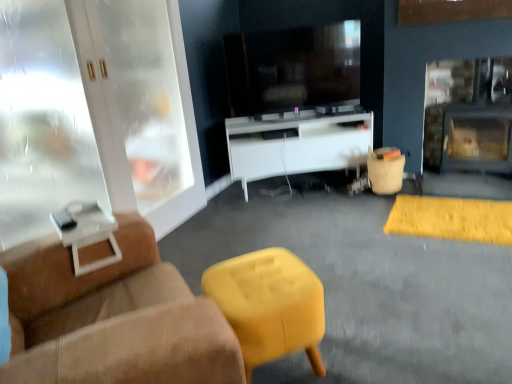
Question: Could you tell me if matte black fireplace at right is turned towards white glossy cabinet at left?

Choices:
 (A) no
 (B) yes

Answer: (A)

Question: From a real-world perspective, is matte black fireplace at right under white glossy cabinet at left?

Choices:
 (A) no
 (B) yes

Answer: (B)

Question: Is matte black fireplace at right at the right side of white glossy cabinet at left?

Choices:
 (A) no
 (B) yes

Answer: (B)

Question: Is matte black fireplace at right positioned before white glossy cabinet at left?

Choices:
 (A) yes
 (B) no

Answer: (B)

Question: Is matte black fireplace at right thinner than white glossy cabinet at left?

Choices:
 (A) no
 (B) yes

Answer: (A)

Question: Is matte black fireplace at right located outside white glossy cabinet at left?

Choices:
 (A) no
 (B) yes

Answer: (B)

Question: From a real-world perspective, is bamboo basket at right, the 1th bar stool positioned from the top, positioned over matte yellow stool at center, the second bar stool viewed from the top, based on gravity?

Choices:
 (A) yes
 (B) no

Answer: (A)

Question: Is bamboo basket at right, marked as the 2th bar stool in a left-to-right arrangement, completely or partially outside of matte yellow stool at center, placed as the 1th bar stool when sorted from front to back?

Choices:
 (A) no
 (B) yes

Answer: (B)

Question: Does bamboo basket at right, which is the first bar stool from back to front, have a larger size compared to matte yellow stool at center, the 1th bar stool in the bottom-to-top sequence?

Choices:
 (A) yes
 (B) no

Answer: (B)

Question: Can you confirm if bamboo basket at right, the 1th bar stool positioned from the top, is taller than matte yellow stool at center, placed as the 1th bar stool when sorted from front to back?

Choices:
 (A) yes
 (B) no

Answer: (B)

Question: Is bamboo basket at right, which is the first bar stool from back to front, shorter than matte yellow stool at center, which is the 1th bar stool in left-to-right order?

Choices:
 (A) no
 (B) yes

Answer: (B)

Question: Is bamboo basket at right, which is the first bar stool from back to front, facing away from matte yellow stool at center, placed as the 1th bar stool when sorted from front to back?

Choices:
 (A) no
 (B) yes

Answer: (A)

Question: Does bamboo basket at right, marked as the 2th bar stool in a left-to-right arrangement, have a larger size compared to suede ottoman at lower center?

Choices:
 (A) yes
 (B) no

Answer: (B)